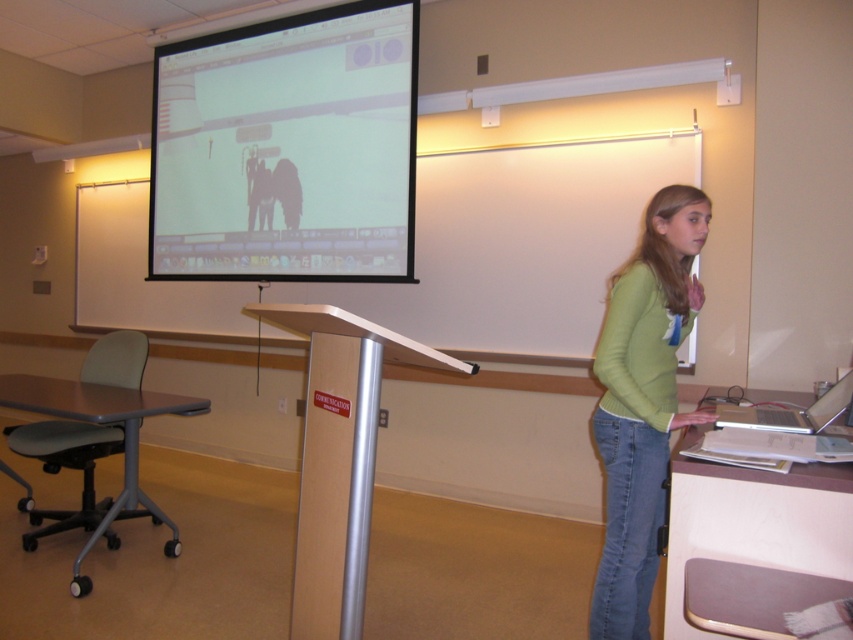
Does light brown wooden table at lower right appear over light brown laminate table at lower left?

Correct, light brown wooden table at lower right is located above light brown laminate table at lower left.

This screenshot has width=853, height=640. I want to click on light brown wooden table at lower right, so click(x=750, y=536).

Between white matte projection screen at upper center and silver metallic laptop at right, which one appears on the right side from the viewer's perspective?

From the viewer's perspective, silver metallic laptop at right appears more on the right side.

What do you see at coordinates (287, 148) in the screenshot? I see `white matte projection screen at upper center` at bounding box center [287, 148].

Locate an element on the screen. The image size is (853, 640). white matte projection screen at upper center is located at coordinates coord(287,148).

Can you confirm if green matte shirt at center is smaller than light brown laminate table at lower left?

Indeed, green matte shirt at center has a smaller size compared to light brown laminate table at lower left.

Measure the distance from green matte shirt at center to light brown laminate table at lower left.

green matte shirt at center and light brown laminate table at lower left are 1.96 meters apart from each other.

Locate an element on the screen. The width and height of the screenshot is (853, 640). green matte shirt at center is located at coordinates (642, 401).